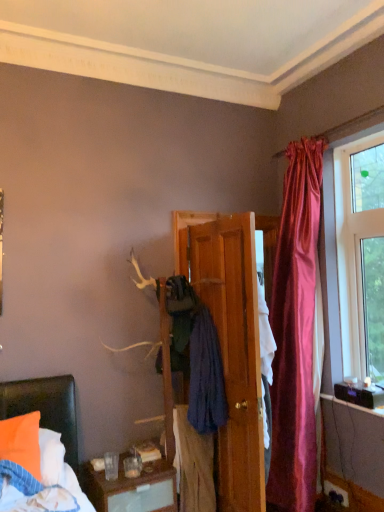
Question: Can you confirm if wooden door at center is positioned to the right of clear glass window at upper right?

Choices:
 (A) no
 (B) yes

Answer: (A)

Question: Is wooden door at center in front of clear glass window at upper right?

Choices:
 (A) yes
 (B) no

Answer: (A)

Question: Is clear glass window at upper right at the back of wooden door at center?

Choices:
 (A) yes
 (B) no

Answer: (B)

Question: From the image's perspective, is wooden door at center located beneath clear glass window at upper right?

Choices:
 (A) no
 (B) yes

Answer: (B)

Question: Does wooden door at center appear on the left side of clear glass window at upper right?

Choices:
 (A) yes
 (B) no

Answer: (A)

Question: Considering the positions of matte black speaker at lower right and blue cotton towel at center, acting as the 1th clothing starting from the top, in the image, is matte black speaker at lower right wider or thinner than blue cotton towel at center, acting as the 1th clothing starting from the top,?

Choices:
 (A) thin
 (B) wide

Answer: (A)

Question: Considering their positions, is matte black speaker at lower right located in front of or behind blue cotton towel at center, acting as the 1th clothing starting from the top?

Choices:
 (A) front
 (B) behind

Answer: (B)

Question: Would you say matte black speaker at lower right is to the left or to the right of blue cotton towel at center, acting as the second clothing starting from the bottom, in the picture?

Choices:
 (A) left
 (B) right

Answer: (B)

Question: From a real-world perspective, is matte black speaker at lower right above or below blue cotton towel at center, acting as the second clothing starting from the bottom?

Choices:
 (A) below
 (B) above

Answer: (A)

Question: Considering the positions of blue cotton towel at center, acting as the 1th clothing starting from the top, and clear glass window at upper right in the image, is blue cotton towel at center, acting as the 1th clothing starting from the top, wider or thinner than clear glass window at upper right?

Choices:
 (A) thin
 (B) wide

Answer: (B)

Question: In terms of size, does blue cotton towel at center, acting as the second clothing starting from the bottom, appear bigger or smaller than clear glass window at upper right?

Choices:
 (A) small
 (B) big

Answer: (B)

Question: Would you say blue cotton towel at center, acting as the 1th clothing starting from the top, is inside or outside clear glass window at upper right?

Choices:
 (A) inside
 (B) outside

Answer: (B)

Question: In terms of height, does blue cotton towel at center, acting as the 1th clothing starting from the top, look taller or shorter compared to clear glass window at upper right?

Choices:
 (A) tall
 (B) short

Answer: (B)

Question: Relative to clear glass window at upper right, is wooden door at center in front or behind?

Choices:
 (A) behind
 (B) front

Answer: (B)

Question: Is wooden door at center wider or thinner than clear glass window at upper right?

Choices:
 (A) thin
 (B) wide

Answer: (B)